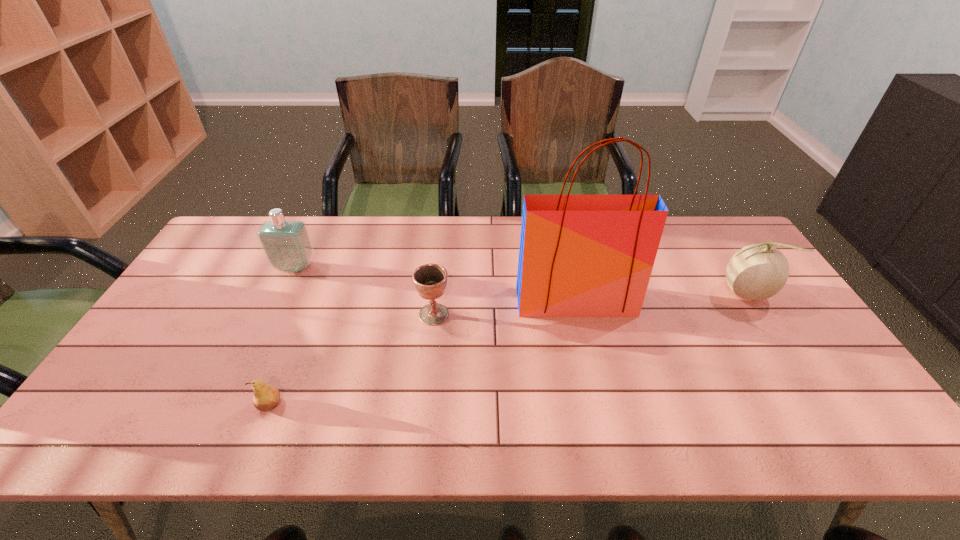
This screenshot has width=960, height=540. I want to click on vacant space located on the left of the rightmost object, so click(676, 293).

Locate an element on the screen. The height and width of the screenshot is (540, 960). vacant space located on the front label of the perfume is located at coordinates (245, 374).

Where is `vacant space located 0.350m on the left of the chalice`? Image resolution: width=960 pixels, height=540 pixels. vacant space located 0.350m on the left of the chalice is located at coordinates (295, 314).

Find the location of `vacant space located on the back of the shortest object`. vacant space located on the back of the shortest object is located at coordinates point(289,358).

What are the coordinates of `object situated at the near edge` in the screenshot? It's located at (266, 397).

At what (x,y) coordinates should I click in order to perform the action: click on object that is at the right edge. Please return your answer as a coordinate pair (x, y). Looking at the image, I should click on (757, 272).

The image size is (960, 540). I want to click on free space at the far edge of the desktop, so click(438, 242).

The height and width of the screenshot is (540, 960). I want to click on free space at the near edge of the desktop, so click(456, 442).

Find the location of a particular element. vacant point at the left edge is located at coordinates (207, 334).

Where is `blank space at the right edge`? Image resolution: width=960 pixels, height=540 pixels. blank space at the right edge is located at coordinates (771, 338).